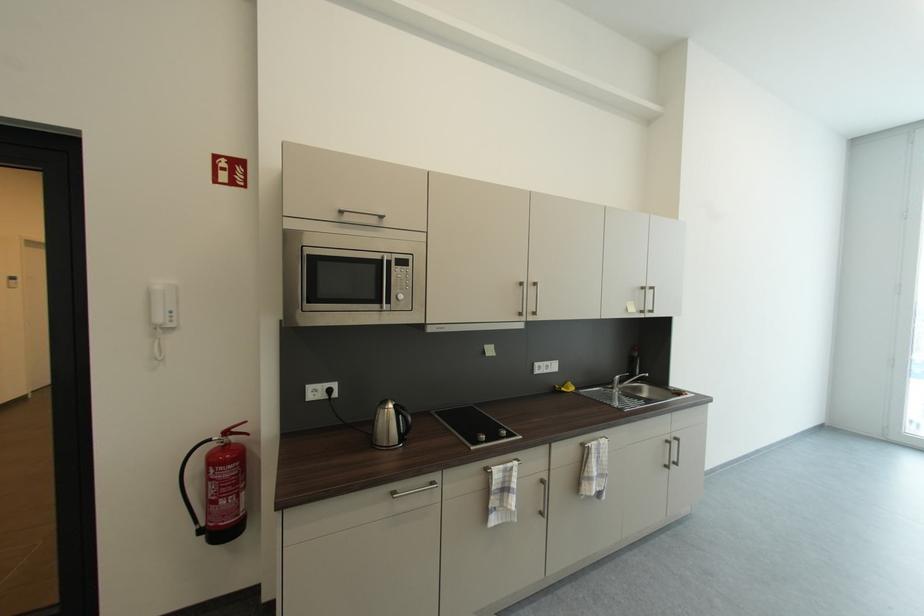
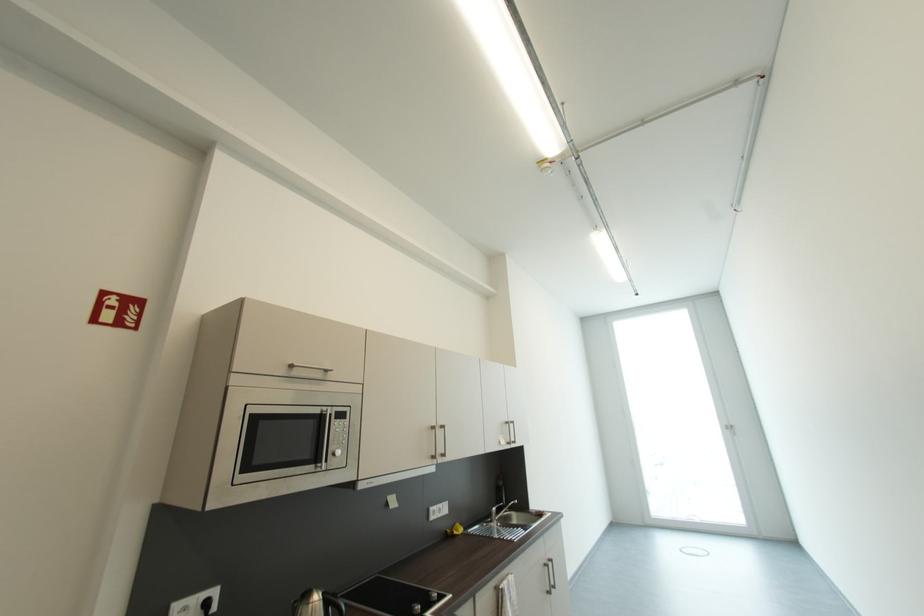
In the second image, find the point that corresponds to the point at 347,213 in the first image.

(298, 368)